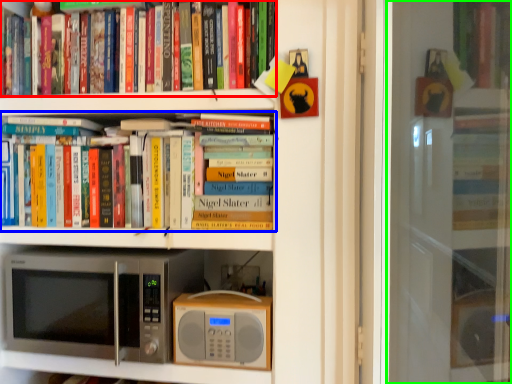
Question: Based on their relative distances, which object is farther from book (highlighted by a red box)? Choose from book (highlighted by a blue box) and screen door (highlighted by a green box).

Choices:
 (A) book
 (B) screen door

Answer: (B)